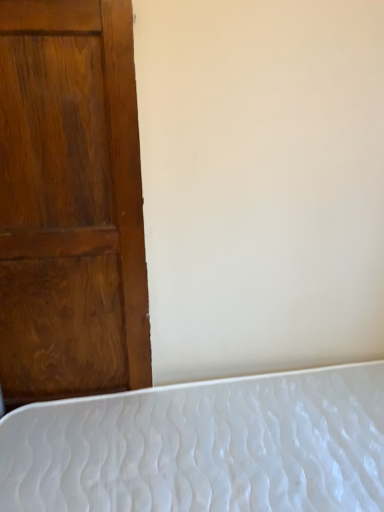
Question: From a real-world perspective, is white textured mattress at lower left above or below shiny brown wood door at left?

Choices:
 (A) below
 (B) above

Answer: (A)

Question: In the image, is white textured mattress at lower left on the left side or the right side of shiny brown wood door at left?

Choices:
 (A) left
 (B) right

Answer: (B)

Question: Relative to shiny brown wood door at left, is white textured mattress at lower left in front or behind?

Choices:
 (A) front
 (B) behind

Answer: (A)

Question: Considering the relative positions of shiny brown wood door at left and white textured mattress at lower left in the image provided, is shiny brown wood door at left to the left or to the right of white textured mattress at lower left?

Choices:
 (A) right
 (B) left

Answer: (B)

Question: Is point (87, 204) closer or farther from the camera than point (297, 426)?

Choices:
 (A) closer
 (B) farther

Answer: (A)

Question: Looking at their shapes, would you say shiny brown wood door at left is wider or thinner than white textured mattress at lower left?

Choices:
 (A) wide
 (B) thin

Answer: (B)

Question: From their relative heights in the image, would you say shiny brown wood door at left is taller or shorter than white textured mattress at lower left?

Choices:
 (A) short
 (B) tall

Answer: (B)